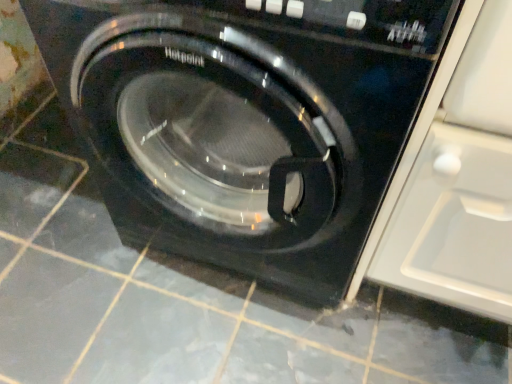
Find the location of a particular element. transparent glossy glass door at right is located at coordinates (461, 186).

This screenshot has width=512, height=384. What do you see at coordinates (461, 186) in the screenshot? I see `transparent glossy glass door at right` at bounding box center [461, 186].

Measure the distance between black glossy washing machine at center and camera.

A distance of 17.44 inches exists between black glossy washing machine at center and camera.

The height and width of the screenshot is (384, 512). What do you see at coordinates (249, 118) in the screenshot? I see `black glossy washing machine at center` at bounding box center [249, 118].

Locate an element on the screen. This screenshot has height=384, width=512. black glossy washing machine at center is located at coordinates (249, 118).

Identify the location of transparent glossy glass door at right. The image size is (512, 384). (461, 186).

Which is more to the right, transparent glossy glass door at right or black glossy washing machine at center?

Positioned to the right is transparent glossy glass door at right.

Which is in front, transparent glossy glass door at right or black glossy washing machine at center?

Positioned in front is transparent glossy glass door at right.

From the picture: Which point is more forward, (431,279) or (317,136)?

Positioned in front is point (317,136).

From the image's perspective, is transparent glossy glass door at right above or below black glossy washing machine at center?

Clearly, from the image's perspective, transparent glossy glass door at right is below black glossy washing machine at center.

From a real-world perspective, is transparent glossy glass door at right above or below black glossy washing machine at center?

transparent glossy glass door at right is below black glossy washing machine at center.

In terms of width, does transparent glossy glass door at right look wider or thinner when compared to black glossy washing machine at center?

transparent glossy glass door at right is thinner than black glossy washing machine at center.

Between transparent glossy glass door at right and black glossy washing machine at center, which one has less height?

transparent glossy glass door at right is shorter.

Who is smaller, transparent glossy glass door at right or black glossy washing machine at center?

Smaller between the two is transparent glossy glass door at right.

Can black glossy washing machine at center be found inside transparent glossy glass door at right?

No, black glossy washing machine at center is not a part of transparent glossy glass door at right.

Is there a large distance between transparent glossy glass door at right and black glossy washing machine at center?

transparent glossy glass door at right is near black glossy washing machine at center, not far away.

Is transparent glossy glass door at right oriented away from black glossy washing machine at center?

No, black glossy washing machine at center is not at the back of transparent glossy glass door at right.

I want to click on glass door on the right side of black glossy washing machine at center, so click(461, 186).

Visually, is black glossy washing machine at center positioned to the left or to the right of transparent glossy glass door at right?

Clearly, black glossy washing machine at center is on the left of transparent glossy glass door at right in the image.

Which is in front, black glossy washing machine at center or transparent glossy glass door at right?

transparent glossy glass door at right is closer to the camera.

Which is in front, point (170, 179) or point (468, 97)?

Point (468, 97)

From the image's perspective, which one is positioned higher, black glossy washing machine at center or transparent glossy glass door at right?

black glossy washing machine at center appears higher in the image.

From a real-world perspective, is black glossy washing machine at center positioned above or below transparent glossy glass door at right?

In terms of real-world spatial position, black glossy washing machine at center is above transparent glossy glass door at right.

Considering the relative sizes of black glossy washing machine at center and transparent glossy glass door at right in the image provided, is black glossy washing machine at center thinner than transparent glossy glass door at right?

In fact, black glossy washing machine at center might be wider than transparent glossy glass door at right.

Considering the sizes of objects black glossy washing machine at center and transparent glossy glass door at right in the image provided, who is taller, black glossy washing machine at center or transparent glossy glass door at right?

black glossy washing machine at center is taller.

Is black glossy washing machine at center bigger than transparent glossy glass door at right?

Yes.

Is black glossy washing machine at center surrounding transparent glossy glass door at right?

Definitely not — transparent glossy glass door at right is not inside black glossy washing machine at center.

Is black glossy washing machine at center next to transparent glossy glass door at right?

black glossy washing machine at center and transparent glossy glass door at right are clearly separated.

Is black glossy washing machine at center oriented towards transparent glossy glass door at right?

No, black glossy washing machine at center does not turn towards transparent glossy glass door at right.

I want to click on washing machine behind the transparent glossy glass door at right, so click(x=249, y=118).

Locate an element on the screen. washing machine above the transparent glossy glass door at right (from a real-world perspective) is located at coordinates (249, 118).

Find the location of a particular element. This screenshot has height=384, width=512. glass door that appears on the right of black glossy washing machine at center is located at coordinates (461, 186).